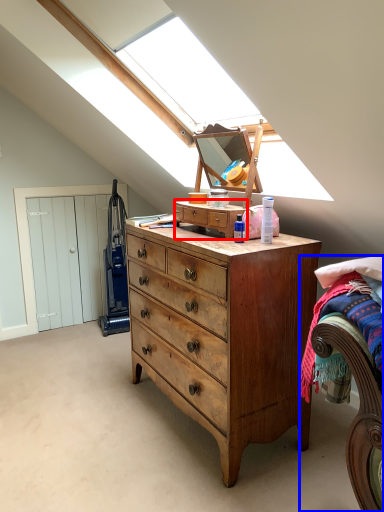
Question: Which object appears closest to the camera in this image, cabinetry (highlighted by a red box) or bed (highlighted by a blue box)?

Choices:
 (A) cabinetry
 (B) bed

Answer: (B)